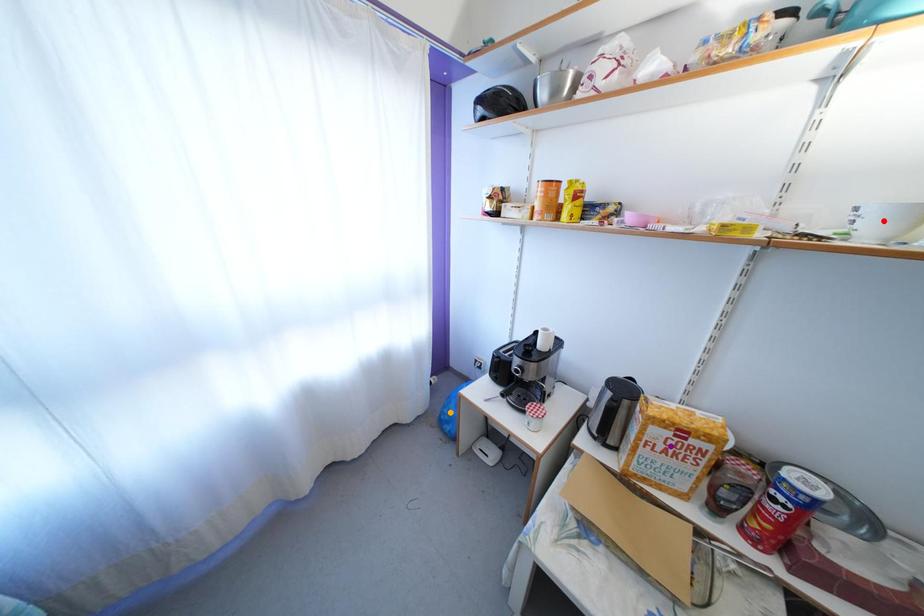
Order these from nearest to farthest:
orange point
purple point
red point

red point
purple point
orange point